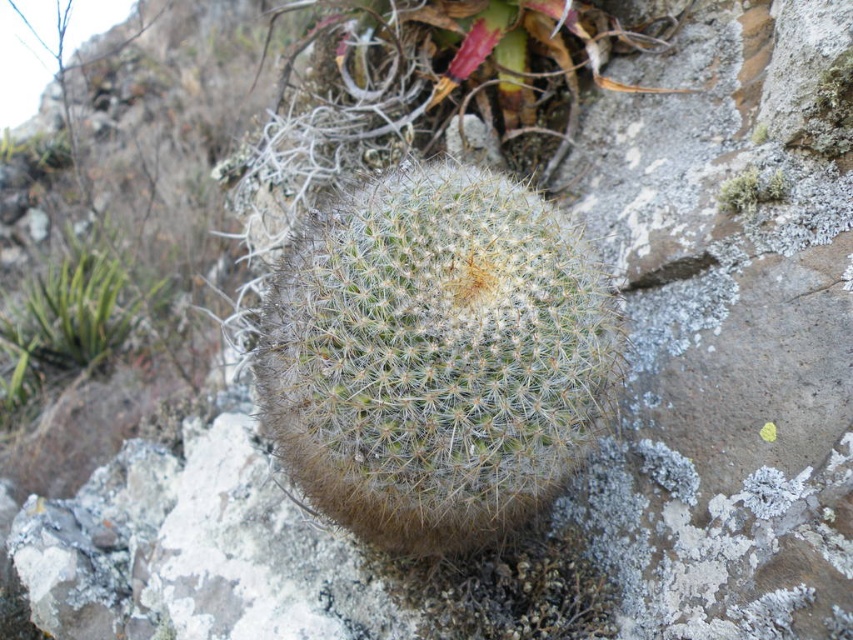
Does white spiny cactus at center appear under white fuzzy lichen at upper right?

Yes, white spiny cactus at center is below white fuzzy lichen at upper right.

Is white spiny cactus at center closer to the viewer compared to white fuzzy lichen at upper right?

Yes, white spiny cactus at center is closer to the viewer.

Who is more forward, (267, 376) or (776, 188)?

Point (267, 376) is more forward.

The height and width of the screenshot is (640, 853). In order to click on white spiny cactus at center in this screenshot , I will do `click(434, 356)`.

Who is more distant from viewer, (114, 346) or (770, 182)?

The point (114, 346) is more distant.

Can you confirm if green spiky cactus at left is positioned above white fuzzy lichen at upper right?

No, green spiky cactus at left is not above white fuzzy lichen at upper right.

Which is behind, point (3, 316) or point (770, 188)?

The point (3, 316) is more distant.

Find the location of a particular element. green spiky cactus at left is located at coordinates (65, 323).

Is white spiny cactus at center wider than green spiky cactus at left?

Yes.

How distant is white spiny cactus at center from green spiky cactus at left?

white spiny cactus at center is 3.05 meters away from green spiky cactus at left.

Does point (553, 292) come farther from viewer compared to point (22, 324)?

No, it is not.

Image resolution: width=853 pixels, height=640 pixels. In order to click on white spiny cactus at center in this screenshot , I will do `click(434, 356)`.